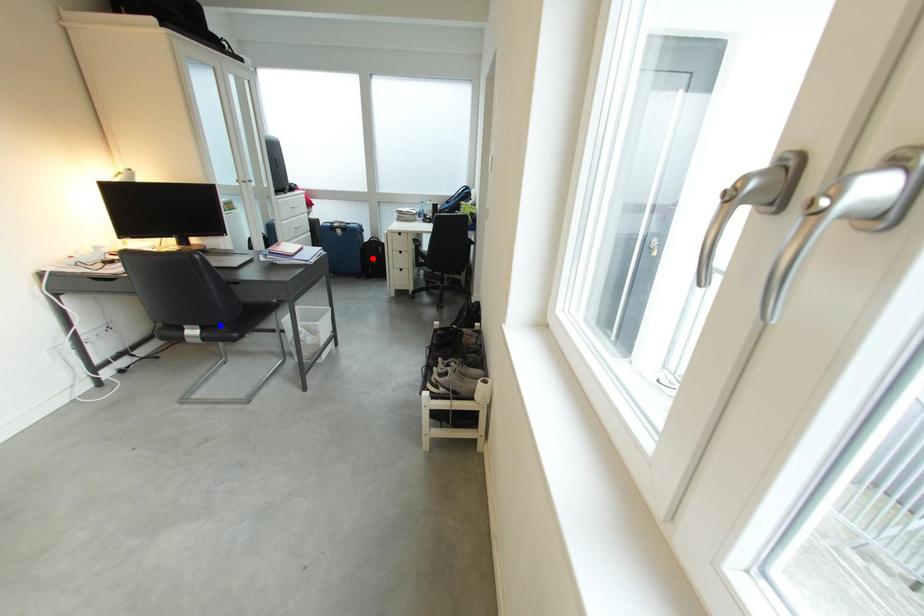
Question: In the image, two points are highlighted. Which point is nearer to the camera? Reply with the corresponding letter.

Choices:
 (A) blue point
 (B) red point

Answer: (A)